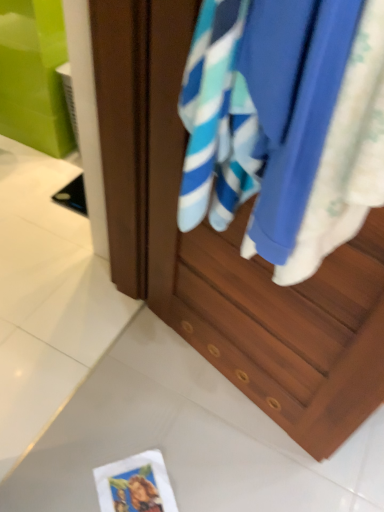
Question: Does white glossy tile at lower center have a larger size compared to wooden cabinet at center?

Choices:
 (A) no
 (B) yes

Answer: (A)

Question: Can you confirm if white glossy tile at lower center is smaller than wooden cabinet at center?

Choices:
 (A) yes
 (B) no

Answer: (A)

Question: From the image's perspective, is white glossy tile at lower center on top of wooden cabinet at center?

Choices:
 (A) no
 (B) yes

Answer: (A)

Question: From a real-world perspective, is white glossy tile at lower center positioned over wooden cabinet at center based on gravity?

Choices:
 (A) yes
 (B) no

Answer: (B)

Question: Is white glossy tile at lower center completely or partially outside of wooden cabinet at center?

Choices:
 (A) no
 (B) yes

Answer: (B)

Question: From a real-world perspective, is white glossy tile at lower center below wooden cabinet at center?

Choices:
 (A) no
 (B) yes

Answer: (B)

Question: Would you say blue cotton towel at center is a long distance from white paper postcard at lower center?

Choices:
 (A) yes
 (B) no

Answer: (B)

Question: From the image's perspective, is blue cotton towel at center under white paper postcard at lower center?

Choices:
 (A) yes
 (B) no

Answer: (B)

Question: Is blue cotton towel at center positioned in front of white paper postcard at lower center?

Choices:
 (A) yes
 (B) no

Answer: (A)

Question: Could white paper postcard at lower center be considered to be inside blue cotton towel at center?

Choices:
 (A) no
 (B) yes

Answer: (A)

Question: From the image's perspective, is blue cotton towel at center on top of white paper postcard at lower center?

Choices:
 (A) yes
 (B) no

Answer: (A)

Question: Can you confirm if blue cotton towel at center is wider than white paper postcard at lower center?

Choices:
 (A) no
 (B) yes

Answer: (A)

Question: From the image's perspective, is white paper postcard at lower center over wooden cabinet at center?

Choices:
 (A) yes
 (B) no

Answer: (B)